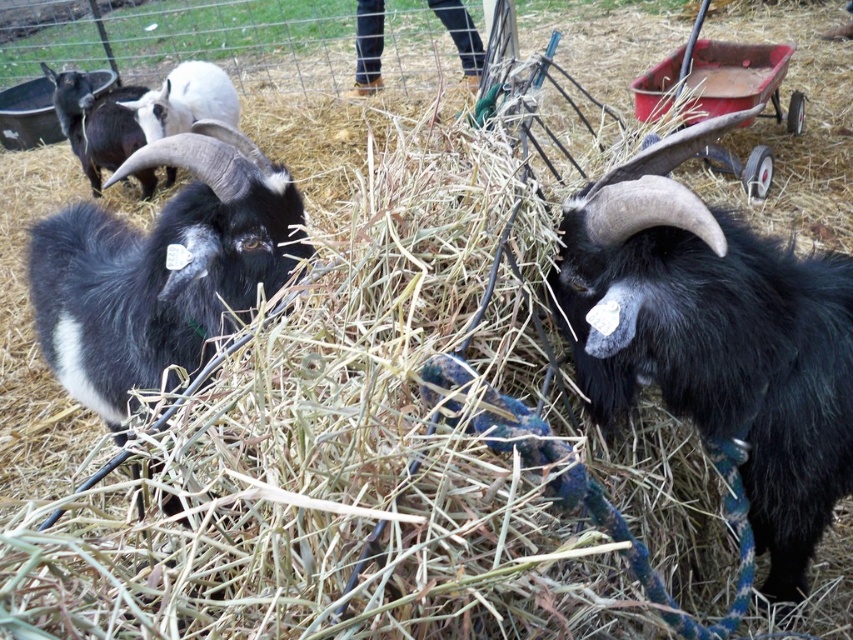
You are a farmer trying to determine which animal is wider between the black woolen goat at upper left and the white woolen sheep at upper left. Based on the scene, which one has a greater width?

The black woolen goat at upper left is wider than the white woolen sheep at upper left according to the description provided.

You are standing at the center of the farm and want to locate the black woolen goat at center. According to the coordinates provided, is it closer to the top or bottom of the image?

The black woolen goat at center is located at point (715,337). Since the y coordinate is 0.839, which is closer to 1.0, it is closer to the top of the image.